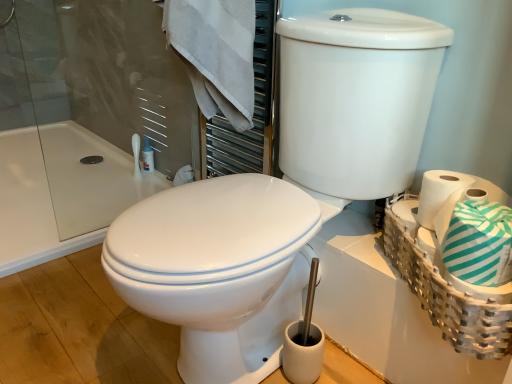
Question: From the image's perspective, is white woven basket at right above or below white cotton towel at upper left?

Choices:
 (A) above
 (B) below

Answer: (B)

Question: From a real-world perspective, is white woven basket at right above or below white cotton towel at upper left?

Choices:
 (A) above
 (B) below

Answer: (B)

Question: Which is nearer to the white cotton towel at upper left?

Choices:
 (A) white woven basket at right
 (B) white glossy toilet at center, which is the 1th toilet from left to right
 (C) teal striped toilet paper at right
 (D) white plastic bottle at upper left
 (E) white glossy toilet at center, positioned as the 2th toilet in left-to-right order

Answer: (E)

Question: Estimate the real-world distances between objects in this image. Which object is closer to the white cotton towel at upper left?

Choices:
 (A) white glossy toilet at center, positioned as the 2th toilet in right-to-left order
 (B) white plastic bottle at upper left
 (C) teal striped toilet paper at right
 (D) white woven basket at right
 (E) white glossy toilet at center, which is the first toilet in right-to-left order

Answer: (E)